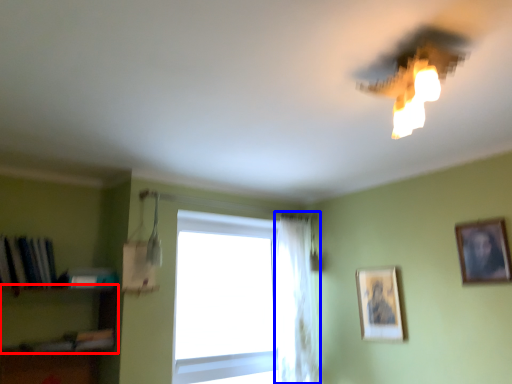
Question: Which object is closer to the camera taking this photo, shelf (highlighted by a red box) or curtain (highlighted by a blue box)?

Choices:
 (A) shelf
 (B) curtain

Answer: (A)